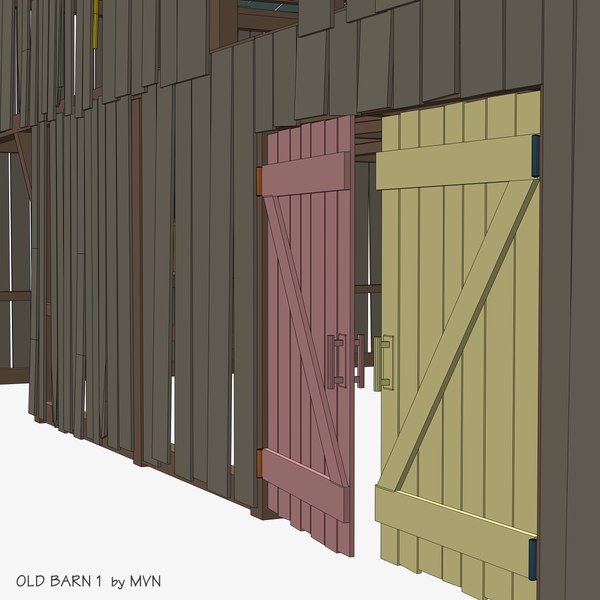
Where is `yellow door handle`? The image size is (600, 600). yellow door handle is located at coordinates (380, 357).